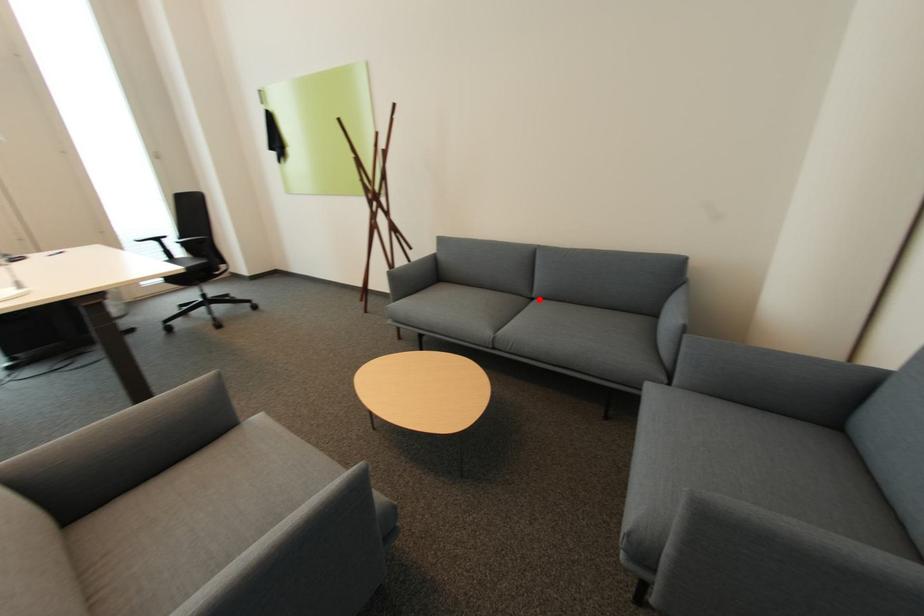
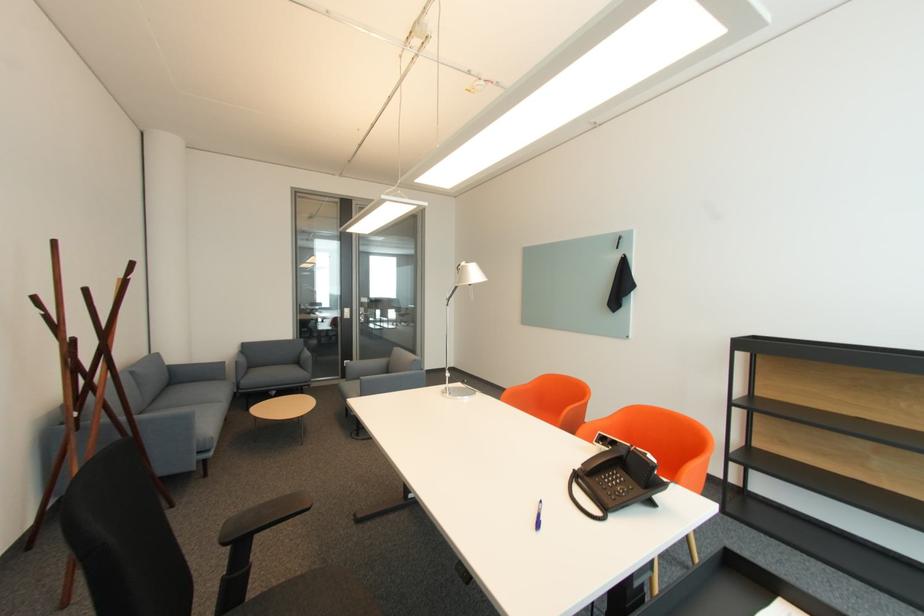
Locate, in the second image, the point that corresponds to the highlighted location in the first image.

(151, 411)